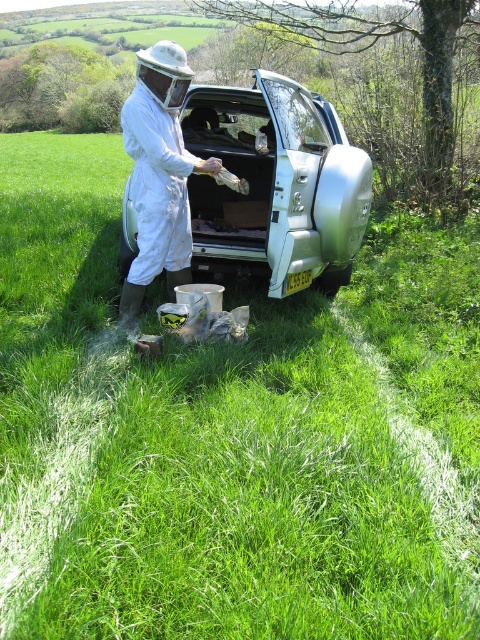
Question: Among these objects, which one is farthest from the camera?

Choices:
 (A) silver metallic car at center
 (B) white fabric beekeeper suit at center

Answer: (A)

Question: Does silver metallic car at center have a lesser width compared to white fabric beekeeper at center?

Choices:
 (A) no
 (B) yes

Answer: (A)

Question: Observing the image, what is the correct spatial positioning of silver metallic car at center in reference to white fabric beekeeper suit at center?

Choices:
 (A) above
 (B) below

Answer: (A)

Question: Can you confirm if silver metallic car at center is positioned above white fabric beekeeper at center?

Choices:
 (A) no
 (B) yes

Answer: (B)

Question: Among these points, which one is farthest from the camera?

Choices:
 (A) (175, 48)
 (B) (177, 120)
 (C) (199, 122)

Answer: (C)

Question: Which point is closer to the camera?

Choices:
 (A) silver metallic car at center
 (B) white fabric beekeeper suit at center
 (C) white fabric beekeeper at center

Answer: (C)